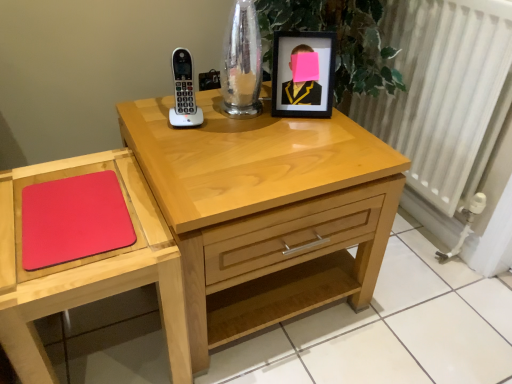
Question: Does white textured radiator at right have a lesser height compared to black matte picture frame at upper right?

Choices:
 (A) yes
 (B) no

Answer: (B)

Question: Is white textured radiator at right in contact with black matte picture frame at upper right?

Choices:
 (A) no
 (B) yes

Answer: (A)

Question: Is white textured radiator at right positioned before black matte picture frame at upper right?

Choices:
 (A) yes
 (B) no

Answer: (A)

Question: Does white textured radiator at right have a lesser width compared to black matte picture frame at upper right?

Choices:
 (A) yes
 (B) no

Answer: (B)

Question: Considering the relative sizes of white textured radiator at right and black matte picture frame at upper right in the image provided, is white textured radiator at right taller than black matte picture frame at upper right?

Choices:
 (A) no
 (B) yes

Answer: (B)

Question: Considering the positions of matte wooden mouse pad at lower left and white textured radiator at right in the image, is matte wooden mouse pad at lower left bigger or smaller than white textured radiator at right?

Choices:
 (A) small
 (B) big

Answer: (A)

Question: From their relative heights in the image, would you say matte wooden mouse pad at lower left is taller or shorter than white textured radiator at right?

Choices:
 (A) tall
 (B) short

Answer: (B)

Question: From the image's perspective, is matte wooden mouse pad at lower left above or below white textured radiator at right?

Choices:
 (A) above
 (B) below

Answer: (B)

Question: Does point (172, 327) appear closer or farther from the camera than point (449, 66)?

Choices:
 (A) closer
 (B) farther

Answer: (A)

Question: Looking at their shapes, would you say black matte picture frame at upper right is wider or thinner than light wood nightstand at center?

Choices:
 (A) thin
 (B) wide

Answer: (A)

Question: Considering their positions, is black matte picture frame at upper right located in front of or behind light wood nightstand at center?

Choices:
 (A) behind
 (B) front

Answer: (A)

Question: Is black matte picture frame at upper right spatially inside light wood nightstand at center, or outside of it?

Choices:
 (A) outside
 (B) inside

Answer: (A)

Question: Considering the positions of point (309, 54) and point (270, 244), is point (309, 54) closer or farther from the camera than point (270, 244)?

Choices:
 (A) farther
 (B) closer

Answer: (A)

Question: Considering the relative positions of white textured radiator at right and light wood nightstand at center in the image provided, is white textured radiator at right to the left or to the right of light wood nightstand at center?

Choices:
 (A) right
 (B) left

Answer: (A)

Question: Which is correct: white textured radiator at right is inside light wood nightstand at center, or outside of it?

Choices:
 (A) outside
 (B) inside

Answer: (A)